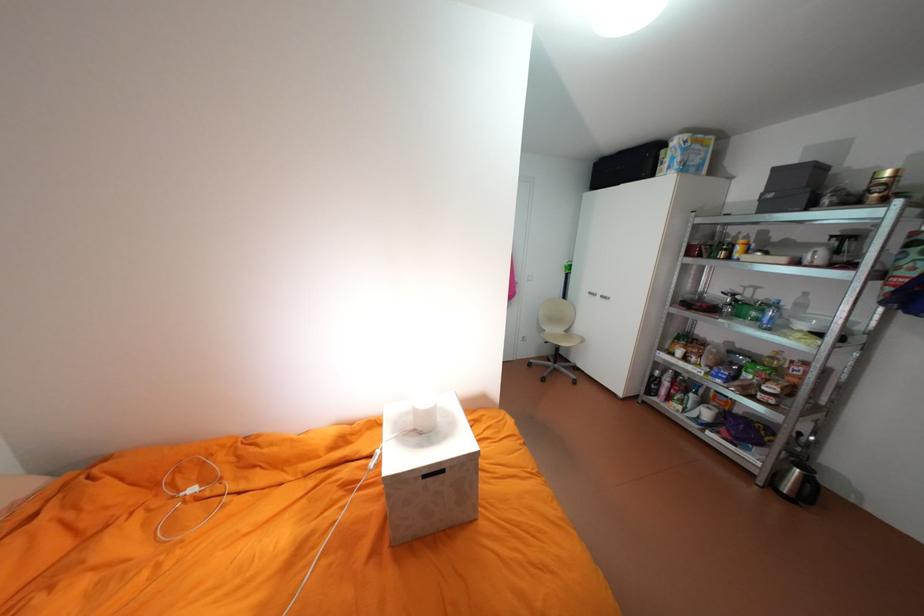
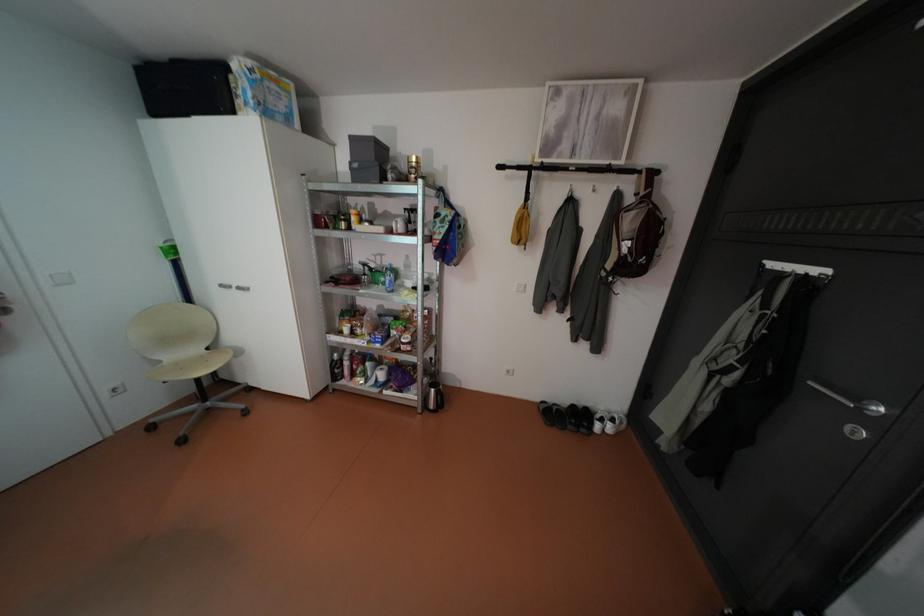
Locate, in the second image, the point that corresponds to (706,160) in the first image.

(290, 107)